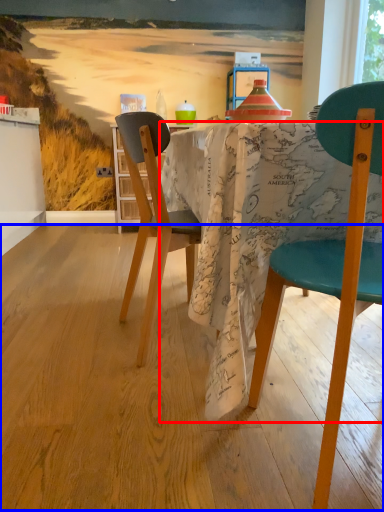
Question: Which object appears farthest to the camera in this image, desk (highlighted by a red box) or plywood (highlighted by a blue box)?

Choices:
 (A) desk
 (B) plywood

Answer: (A)